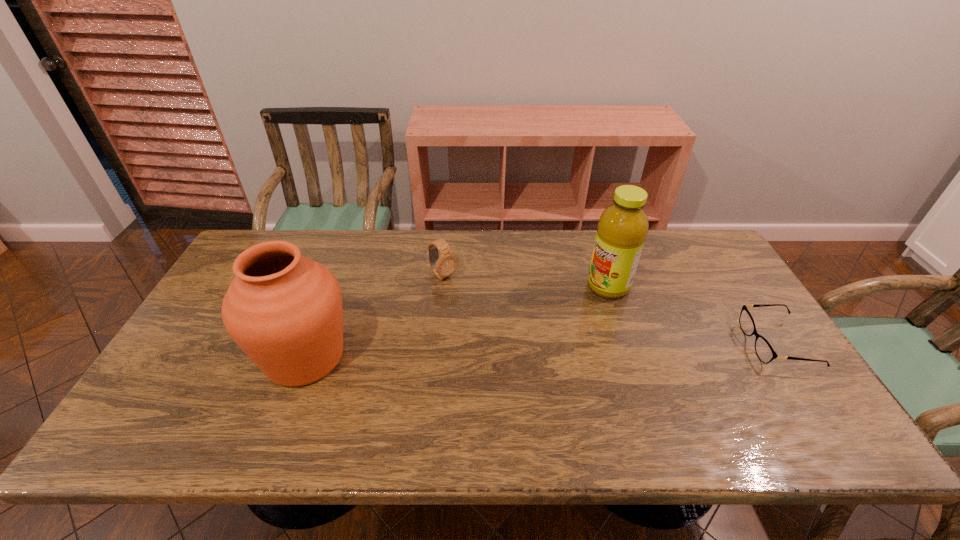
Where is `free space on the desktop that is between the urn and the spectacles and is positioned on the face of the watch`? The width and height of the screenshot is (960, 540). free space on the desktop that is between the urn and the spectacles and is positioned on the face of the watch is located at coordinates (525, 351).

This screenshot has width=960, height=540. I want to click on free space on the desktop that is between the leftmost object and the shortest object and is positioned on the front label of the fruit juice, so [x=475, y=352].